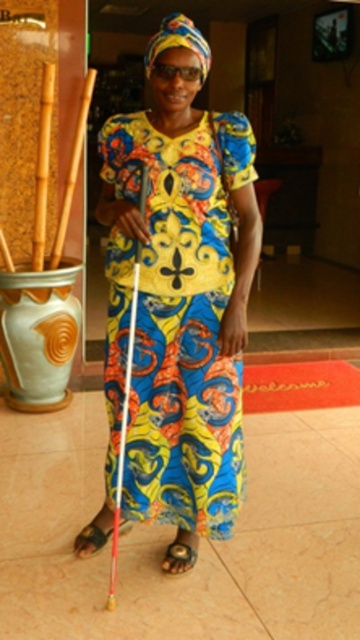
Question: Does matte colorful dress at center have a greater width compared to black leather sandal at lower center?

Choices:
 (A) no
 (B) yes

Answer: (B)

Question: Considering the real-world distances, which object is farthest from the brown leather sandal at lower left?

Choices:
 (A) black leather sandal at lower center
 (B) matte colorful dress at center

Answer: (B)

Question: Does matte colorful dress at center appear on the left side of brown leather sandal at lower left?

Choices:
 (A) yes
 (B) no

Answer: (B)

Question: Which point is farther to the camera?

Choices:
 (A) brown leather sandal at lower left
 (B) black leather sandal at lower center
 (C) matte colorful dress at center

Answer: (A)

Question: Estimate the real-world distances between objects in this image. Which object is closer to the brown leather sandal at lower left?

Choices:
 (A) black leather sandal at lower center
 (B) matte colorful dress at center

Answer: (A)

Question: Can you confirm if matte colorful dress at center is positioned below brown leather sandal at lower left?

Choices:
 (A) no
 (B) yes

Answer: (A)